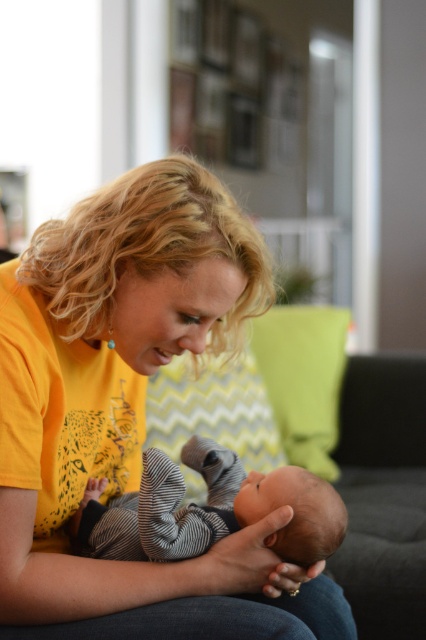
Question: Is yellow zigzag fabric pillow at center to the right of green zigzag fabric pillow at center from the viewer's perspective?

Choices:
 (A) yes
 (B) no

Answer: (B)

Question: Which point appears farthest from the camera in this image?

Choices:
 (A) (198, 426)
 (B) (14, 634)
 (C) (155, 468)

Answer: (A)

Question: Does striped cotton onesie at center lie behind green zigzag fabric pillow at center?

Choices:
 (A) no
 (B) yes

Answer: (A)

Question: Which point is closer to the camera taking this photo?

Choices:
 (A) (100, 538)
 (B) (282, 339)
 (C) (166, 236)

Answer: (C)

Question: Which point is closer to the camera?

Choices:
 (A) green zigzag fabric pillow at center
 (B) yellow zigzag fabric pillow at center
 (C) yellow matte shirt at center
 (D) striped cotton onesie at center

Answer: (C)

Question: Can you confirm if yellow matte shirt at center is positioned to the right of yellow zigzag fabric pillow at center?

Choices:
 (A) yes
 (B) no

Answer: (B)